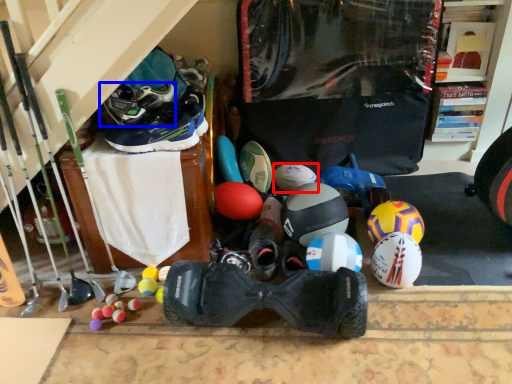
Question: Which point is closer to the camera, ball (highlighted by a red box) or footwear (highlighted by a blue box)?

Choices:
 (A) ball
 (B) footwear

Answer: (B)